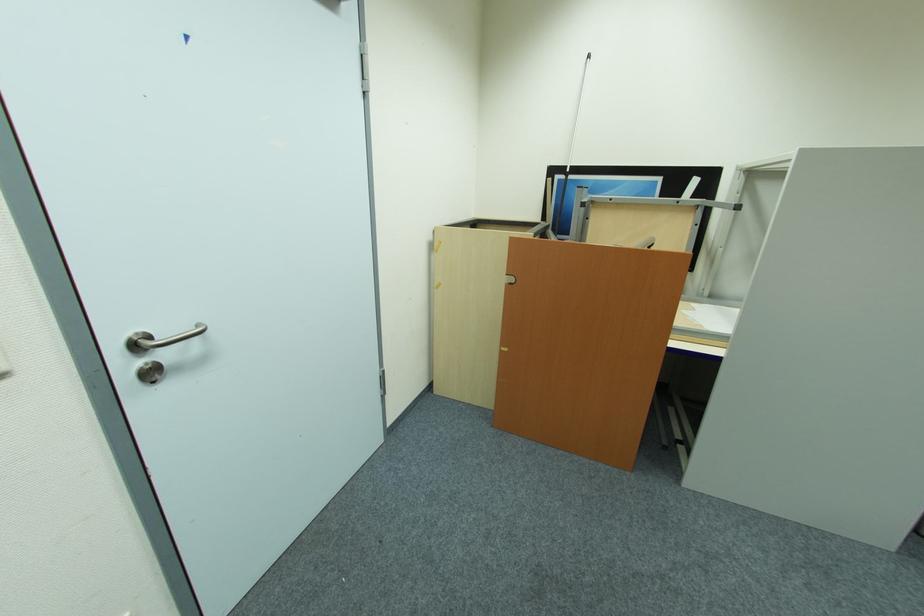
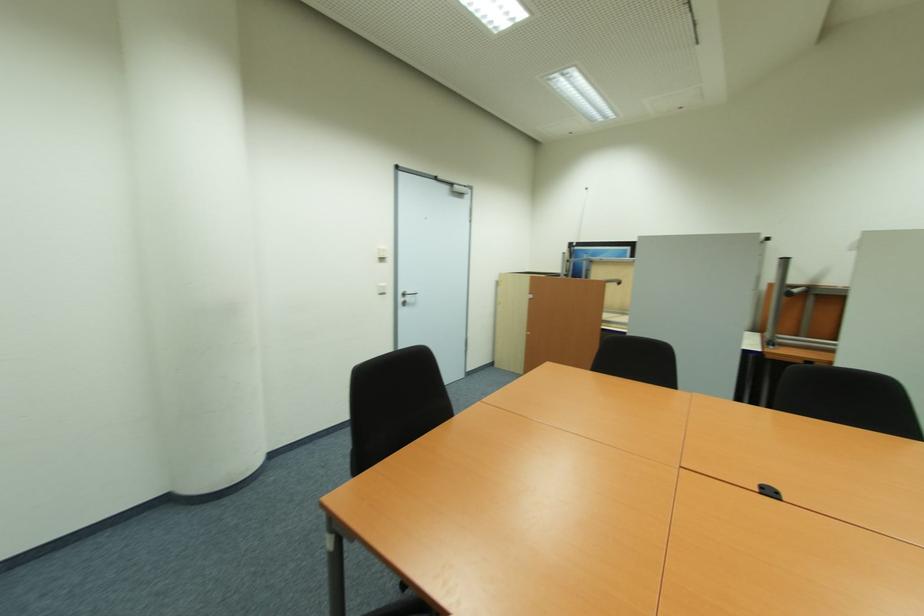
Question: The images are taken continuously from a first-person perspective. In which direction are you moving?

Choices:
 (A) Left
 (B) Right
 (C) Forward
 (D) Backward

Answer: (D)